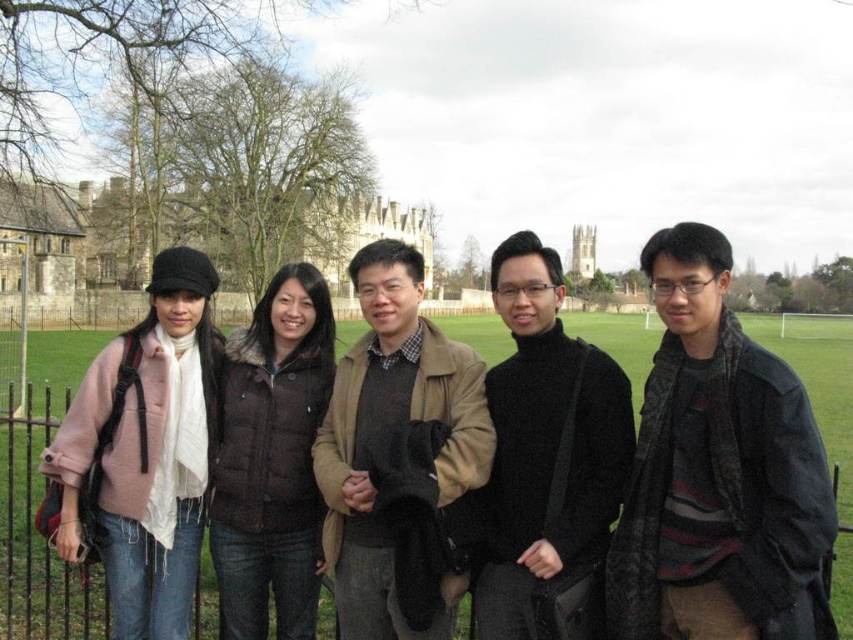
You are a photographer adjusting your camera settings to focus on two specific points in the image. The first point is labeled as point (370, 488) and the second is point (817, 328). Since you want to ensure the closest point to the camera is in focus first, which point should you prioritize focusing on?

Point (370, 488) is closer to the camera than point (817, 328), so you should prioritize focusing on point (370, 488) first.

You are a photographer standing at the camera position. You want to adjust the zoom to include both the dark gray wool scarf at right and the camera in the same frame. Given their distance apart, what is the minimum zoom level required to capture both objects in the frame?

The dark gray wool scarf at right and the camera are 132.98 feet apart. To include both in the same frame, the minimum zoom level required would need to accommodate this distance, typically achievable with a wide angle or lower zoom setting.